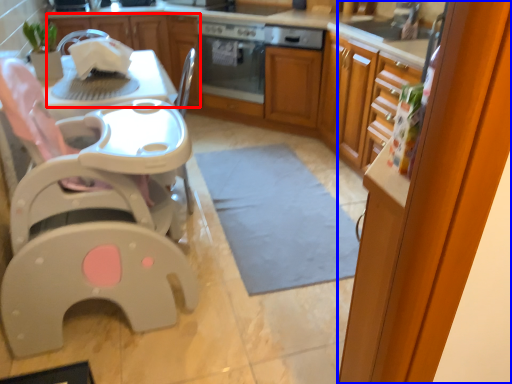
Question: Which point is closer to the camera, cabinetry (highlighted by a red box) or screen door (highlighted by a blue box)?

Choices:
 (A) cabinetry
 (B) screen door

Answer: (B)